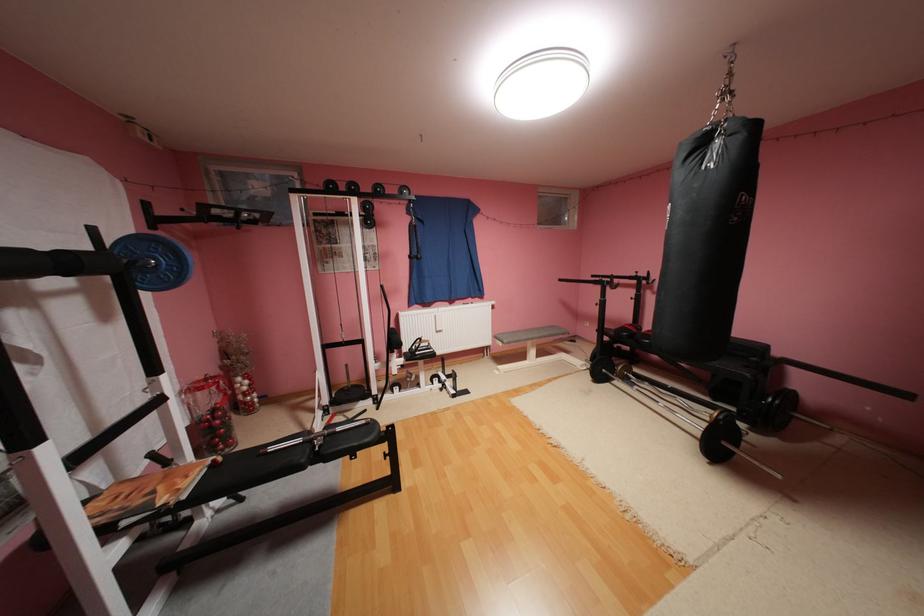
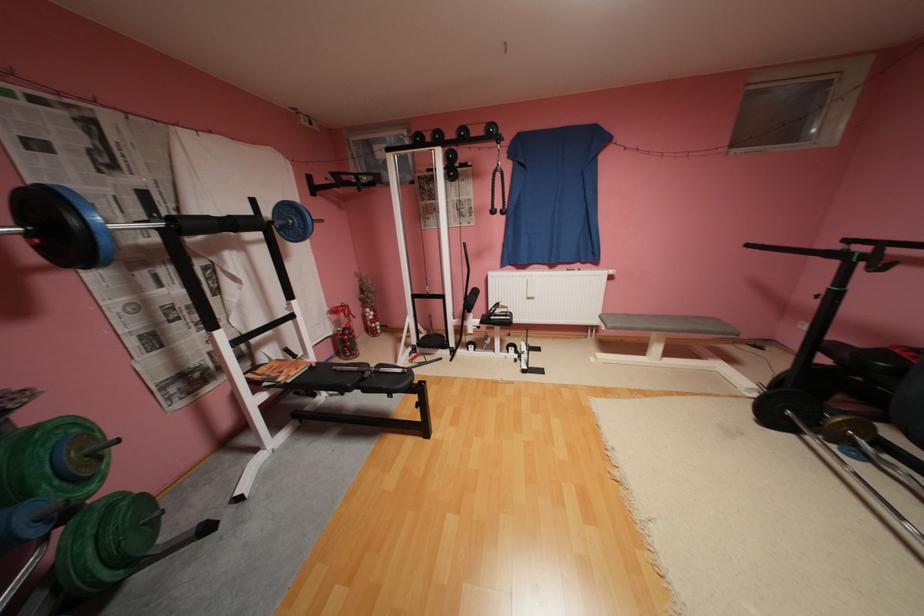
Locate, in the second image, the point that corresponds to (x=162, y=493) in the first image.

(290, 371)